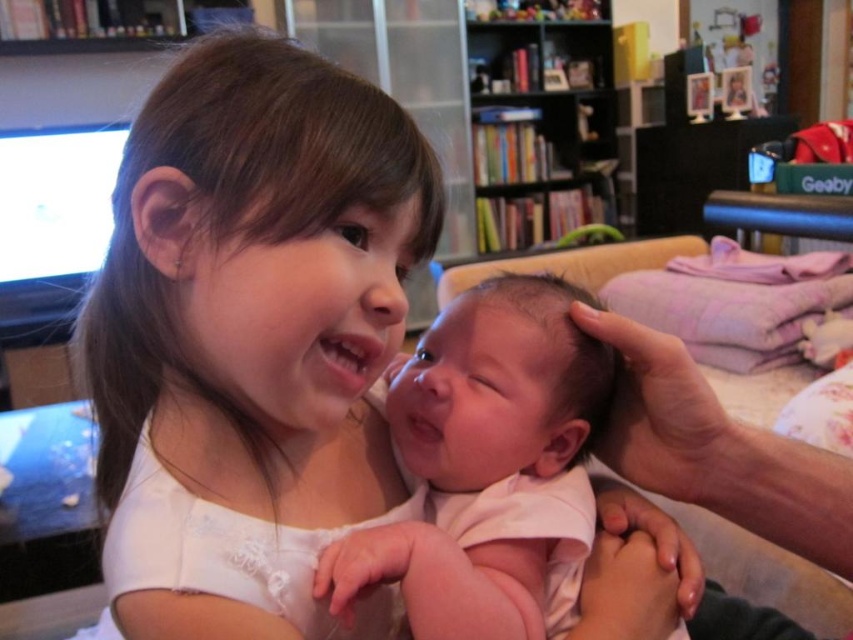
You are a photographer standing in front of the smooth white shirt at center. You want to take a clear photo of it without any blur. What is the minimum distance you should maintain to ensure the photo is sharp?

The smooth white shirt at center is 14.73 inches away from the viewer. To ensure a clear, nonblurry photo, the photographer should maintain a distance of at least 14.73 inches from the smooth white shirt at center.

You are a fashion designer who wants to place a small logo on the smooth white shirt at center. According to the coordinates provided, where should the logo be placed?

The smooth white shirt at center should have the logo placed at point (251, 339) as per the coordinates provided.